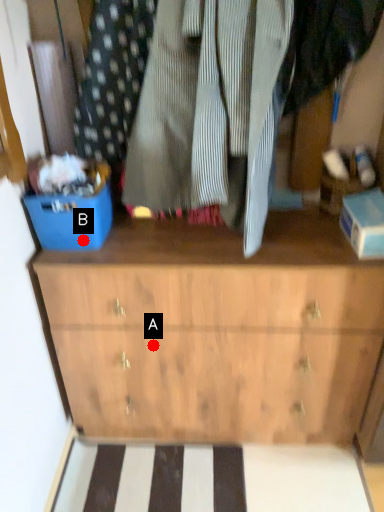
Question: Two points are circled on the image, labeled by A and B beside each circle. Which of the following is the farthest from the observer?

Choices:
 (A) A is further
 (B) B is further

Answer: (A)